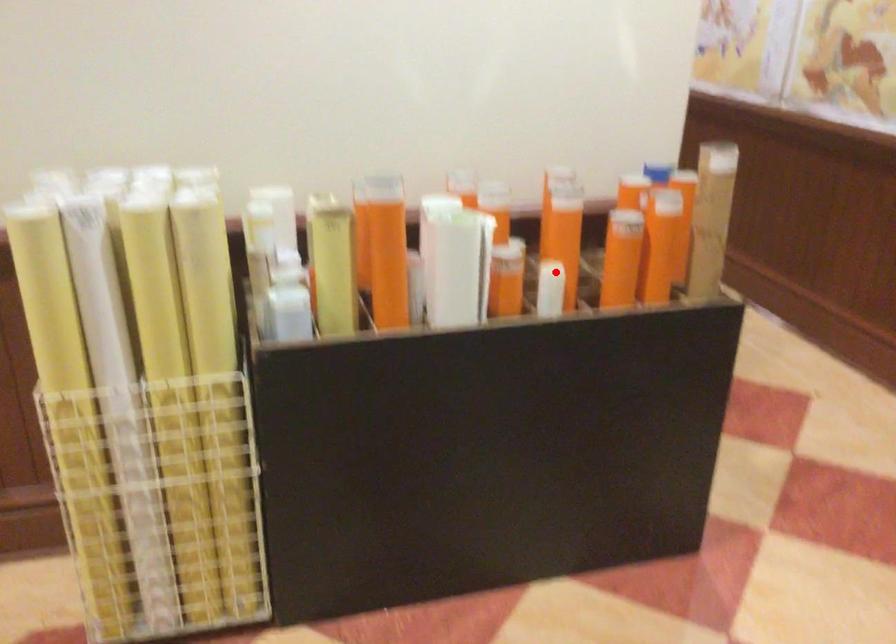
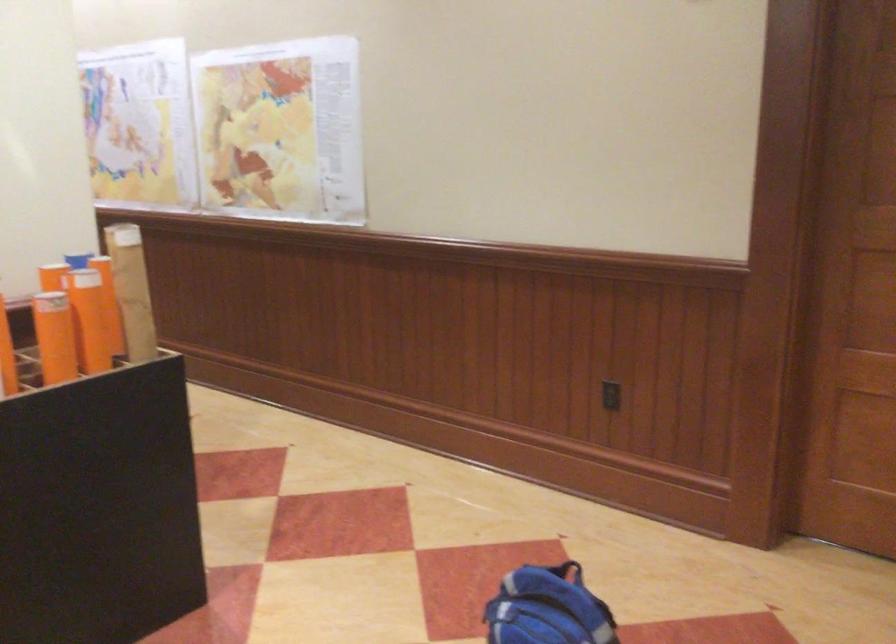
Where in the second image is the point corresponding to the highlighted location from the first image?

(6, 355)